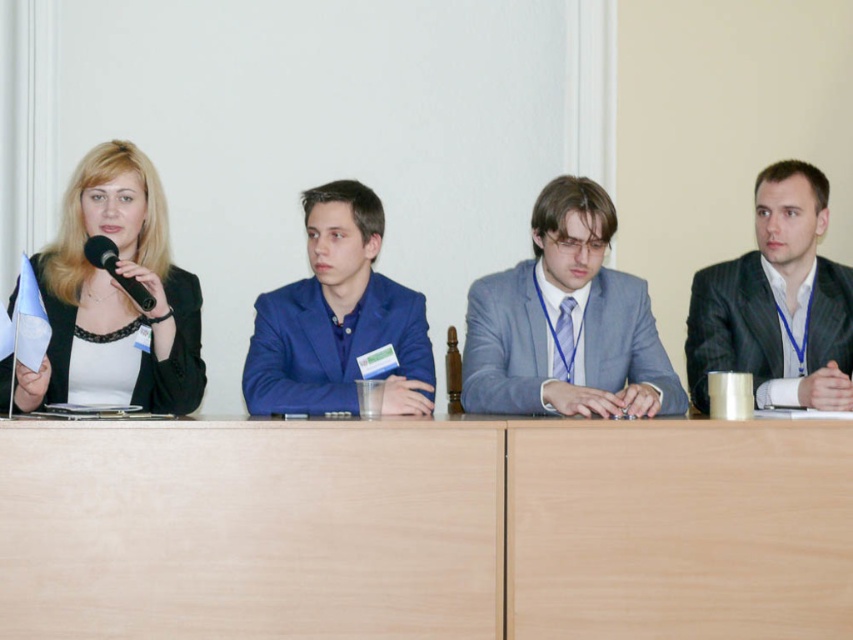
Question: Can you confirm if black textured suit at right is wider than black plastic microphone at left?

Choices:
 (A) no
 (B) yes

Answer: (B)

Question: Where is matte black jacket at left located in relation to black textured suit at right in the image?

Choices:
 (A) right
 (B) left

Answer: (B)

Question: Which point appears closest to the camera in this image?

Choices:
 (A) (163, 196)
 (B) (766, 326)

Answer: (A)

Question: Which object appears farthest from the camera in this image?

Choices:
 (A) light brown wood table at center
 (B) black textured suit at right
 (C) light gray suit at center
 (D) blue satin suit at center

Answer: (B)

Question: Estimate the real-world distances between objects in this image. Which object is closer to the light brown wood table at center?

Choices:
 (A) black textured suit at right
 (B) blue satin suit at center

Answer: (B)

Question: Can you confirm if light gray suit at center is wider than black textured suit at right?

Choices:
 (A) no
 (B) yes

Answer: (B)